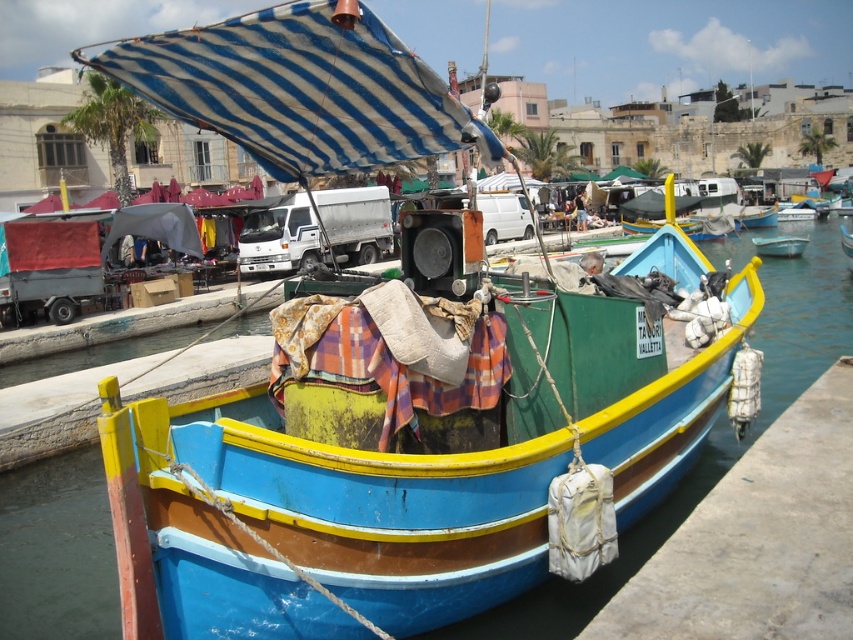
Who is shorter, blue striped fabric canopy at upper center or smooth concrete dock at lower right?

Standing shorter between the two is blue striped fabric canopy at upper center.

Can you confirm if blue striped fabric canopy at upper center is wider than smooth concrete dock at lower right?

Incorrect, blue striped fabric canopy at upper center's width does not surpass smooth concrete dock at lower right's.

Is point (305, 161) positioned after point (799, 432)?

That is False.

Find the location of a particular element. blue striped fabric canopy at upper center is located at coordinates click(300, 88).

Between blue striped fabric canopy at upper center and light blue plastic boat at center, which one appears on the right side from the viewer's perspective?

From the viewer's perspective, light blue plastic boat at center appears more on the right side.

Is blue striped fabric canopy at upper center taller than light blue plastic boat at center?

Indeed, blue striped fabric canopy at upper center has a greater height compared to light blue plastic boat at center.

Which is behind, point (257, 161) or point (761, 252)?

The point (761, 252) is behind.

The image size is (853, 640). Find the location of `blue striped fabric canopy at upper center`. blue striped fabric canopy at upper center is located at coordinates (300, 88).

Does wooden boat at center have a greater height compared to light blue plastic boat at center?

No.

Which is above, wooden boat at center or light blue plastic boat at center?

light blue plastic boat at center

Between point (460, 298) and point (793, 241), which one is positioned behind?

Positioned behind is point (793, 241).

Image resolution: width=853 pixels, height=640 pixels. What are the coordinates of `wooden boat at center` in the screenshot? It's located at (419, 444).